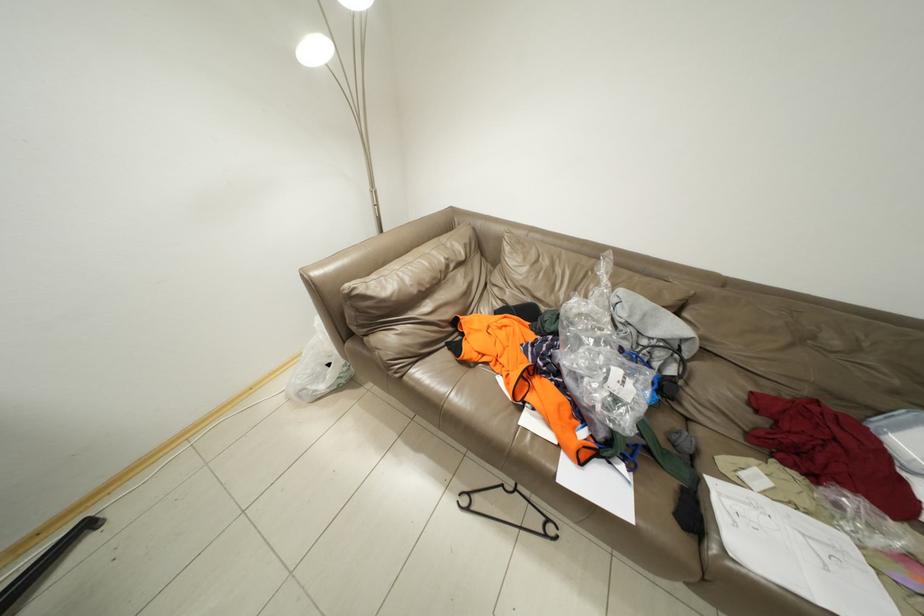
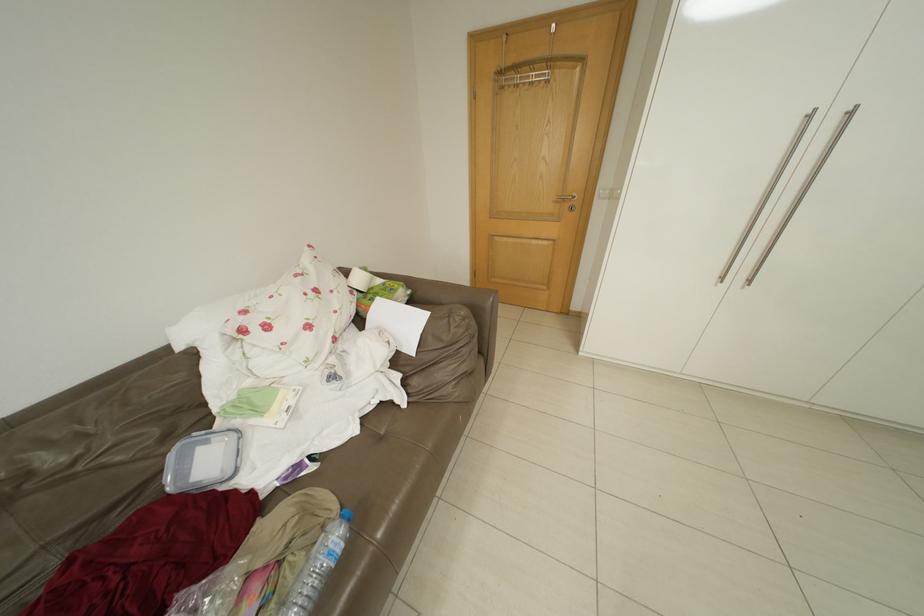
How did the camera likely rotate?

The rotation direction of the camera is right-down.